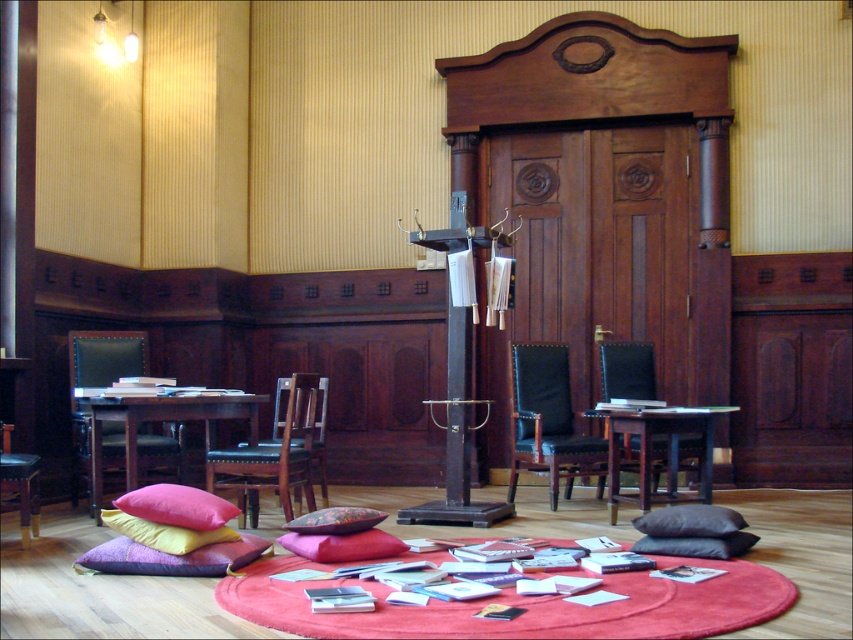
You are a guest in this room and want to sit down. The black leather armchair at center and the floral fabric cushion at center are both available. Which one is taller?

The black leather armchair at center is much taller than the floral fabric cushion at center.

You are standing in the room and want to move from the wooden table at left to the dark brown cushion at center. Which direction should you move to get closer to the cushion?

You should move towards the dark brown cushion at center. Since the wooden table at left is further away from you than the cushion, moving forward in the direction of the cushion will bring you closer.

From the picture: You are organizing a meeting in this room and need to place a laptop on the wooden table at left and a folder on the dark brown cushion at center. Which object should you approach first if you are standing to the right of both objects?

You should approach the dark brown cushion at center first because it is closer to your position on the right side of both objects.